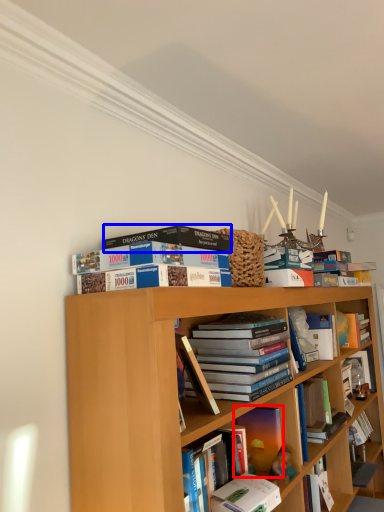
Question: Which object is closer to the camera taking this photo, book (highlighted by a red box) or book (highlighted by a blue box)?

Choices:
 (A) book
 (B) book

Answer: (B)